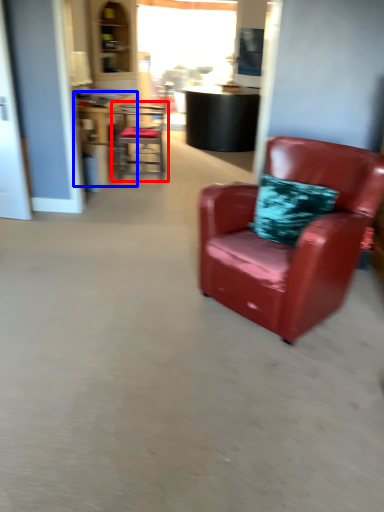
Question: Which of the following is the closest to the observer, chair (highlighted by a red box) or table (highlighted by a blue box)?

Choices:
 (A) chair
 (B) table

Answer: (B)